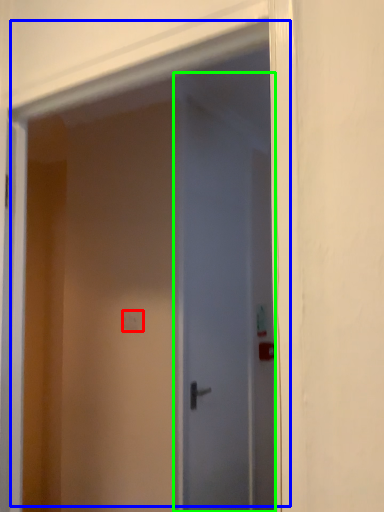
Question: Based on their relative distances, which object is nearer to light switch (highlighted by a red box)? Choose from door (highlighted by a blue box) and door (highlighted by a green box).

Choices:
 (A) door
 (B) door

Answer: (B)